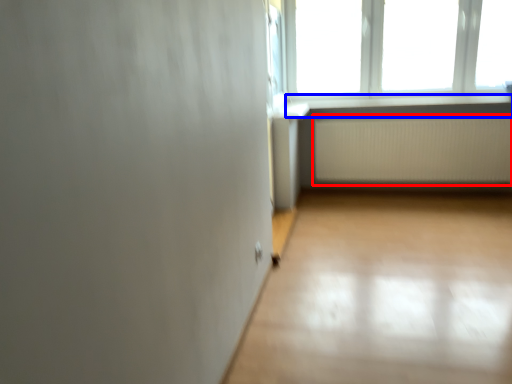
Question: Which object appears farthest to the camera in this image, radiator (highlighted by a red box) or window sill (highlighted by a blue box)?

Choices:
 (A) radiator
 (B) window sill

Answer: (A)